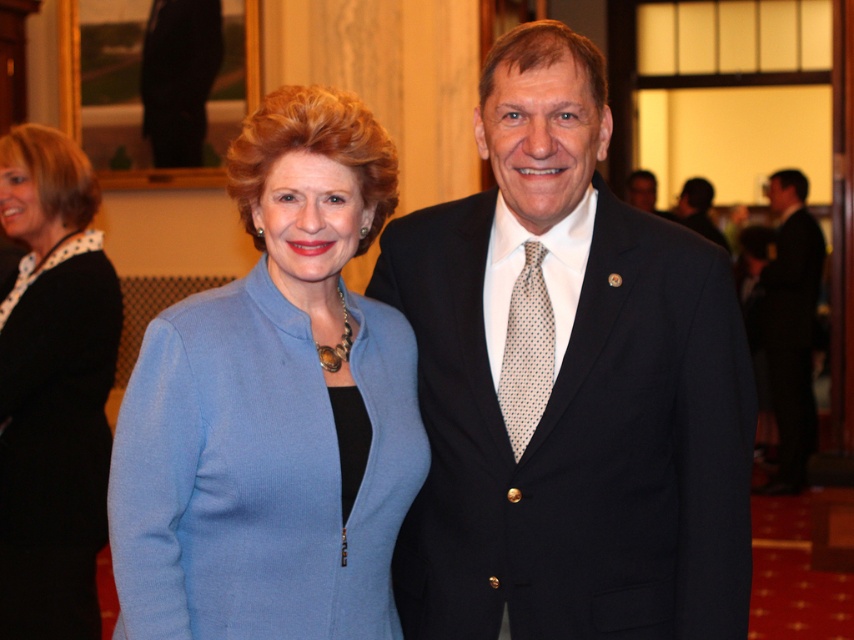
You are taking a photo of two people standing at point (x=275, y=392) and point (x=686, y=186). Which person is closer to the camera?

The person at point (x=275, y=392) is closer to the camera than the person at point (x=686, y=186).

You are taking a photo of two people at a formal event. You notice two points marked in the image at coordinates point (533,426) and point (682,195). If you want to focus on the point that is closer to you, which coordinate should you choose?

Point (533,426) is closer to the camera than point (682,195), so you should choose point (533,426) to focus on the point closer to you.